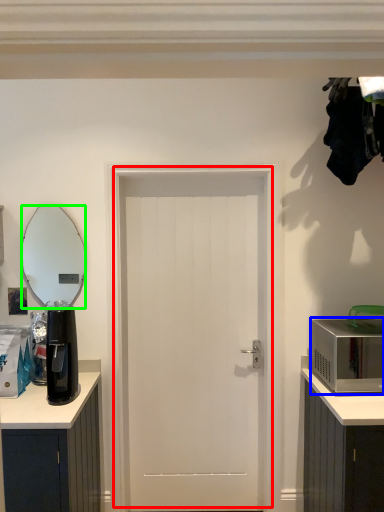
Question: Estimate the real-world distances between objects in this image. Which object is farther from door (highlighted by a red box), microwave oven (highlighted by a blue box) or mirror (highlighted by a green box)?

Choices:
 (A) microwave oven
 (B) mirror

Answer: (B)